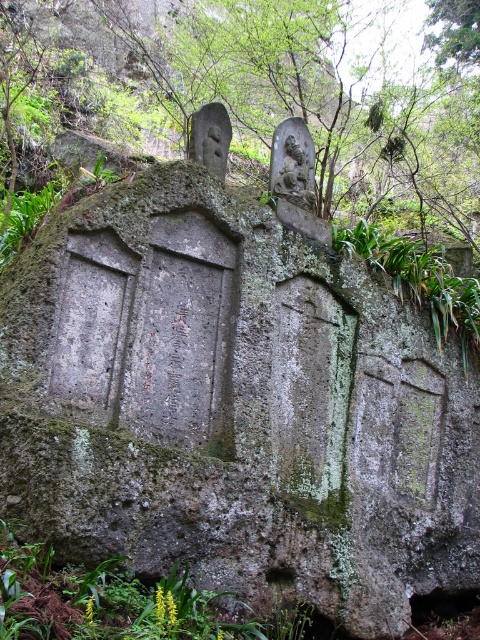
Between point (447, 326) and point (282, 122), which one is positioned behind?

Point (282, 122)

Is point (271, 4) farther from camera compared to point (307, 145)?

Yes, it is behind point (307, 145).

Image resolution: width=480 pixels, height=640 pixels. I want to click on green mossy rock at center, so click(339, 125).

Image resolution: width=480 pixels, height=640 pixels. I want to click on green mossy rock at center, so [339, 125].

Does green leafy plants at lower left have a greater height compared to carved stone statue at center?

In fact, green leafy plants at lower left may be shorter than carved stone statue at center.

The width and height of the screenshot is (480, 640). What are the coordinates of `green leafy plants at lower left` in the screenshot? It's located at (118, 602).

In order to click on green leafy plants at lower left in this screenshot , I will do `click(118, 602)`.

Between green mossy rock at center and green leafy plants at lower left, which one is positioned lower?

green leafy plants at lower left

Describe the element at coordinates (339, 125) in the screenshot. I see `green mossy rock at center` at that location.

The width and height of the screenshot is (480, 640). Find the location of `green mossy rock at center`. green mossy rock at center is located at coordinates (339, 125).